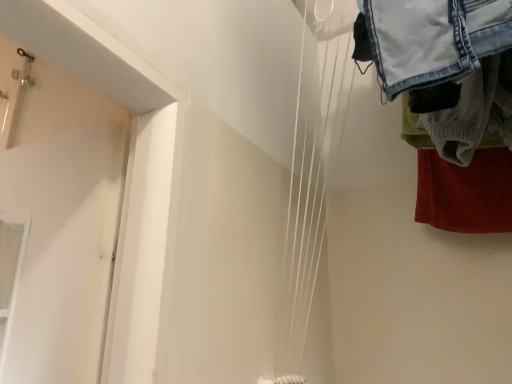
Question: Would you say denim fabric laundry at upper right is to the left or to the right of white matte wires at center in the picture?

Choices:
 (A) right
 (B) left

Answer: (A)

Question: Relative to white matte wires at center, is denim fabric laundry at upper right in front or behind?

Choices:
 (A) front
 (B) behind

Answer: (B)

Question: Is denim fabric laundry at upper right inside the boundaries of white matte wires at center, or outside?

Choices:
 (A) inside
 (B) outside

Answer: (B)

Question: Considering the positions of point (290, 360) and point (397, 64), is point (290, 360) closer or farther from the camera than point (397, 64)?

Choices:
 (A) farther
 (B) closer

Answer: (A)

Question: Is white matte wires at center bigger or smaller than denim fabric laundry at upper right?

Choices:
 (A) big
 (B) small

Answer: (B)

Question: From the image's perspective, relative to denim fabric laundry at upper right, is white matte wires at center above or below?

Choices:
 (A) below
 (B) above

Answer: (A)

Question: Is white matte wires at center situated inside denim fabric laundry at upper right or outside?

Choices:
 (A) outside
 (B) inside

Answer: (A)